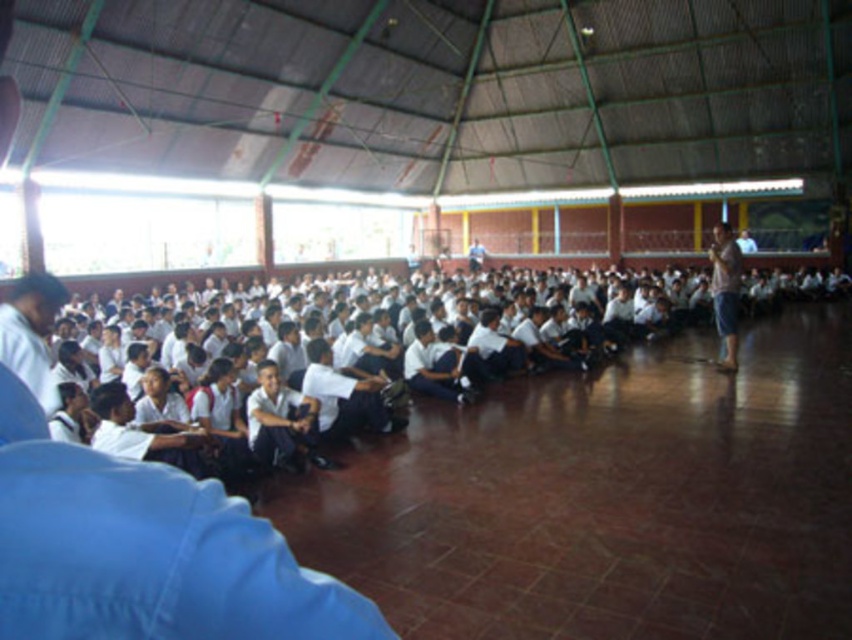
You are standing in the assembly hall and see the blue fabric shirt at left. If you want to reach it in 2 seconds, what is the minimum speed you need to move towards it?

The blue fabric shirt at left is 4.00 meters away. To reach it in 2 seconds, you need to move at a minimum speed of 2.00 meters per second.

You are standing in the assembly hall and notice a blue fabric shirt at left. Can you tell me the exact coordinates where you can find it?

The blue fabric shirt at left is located at coordinates point (32,333).